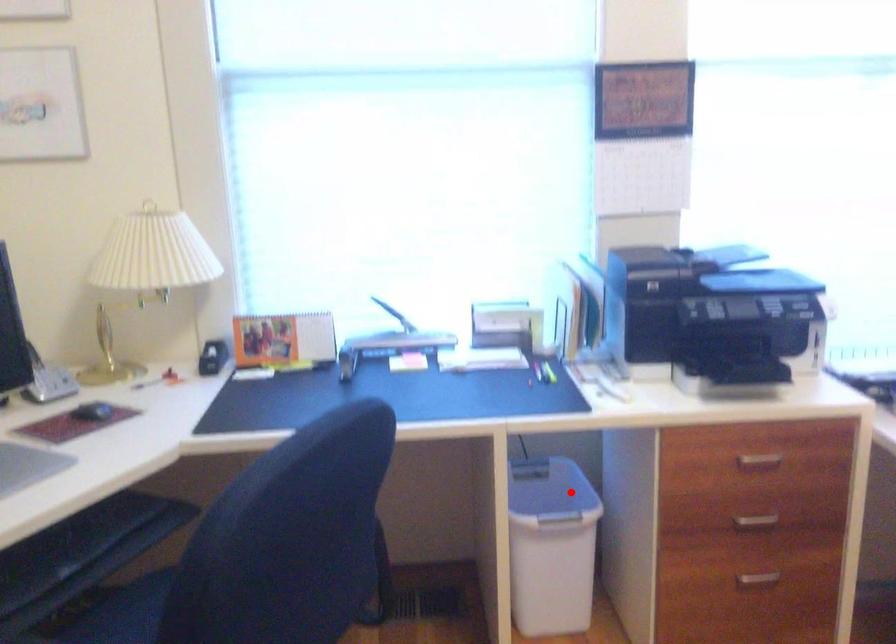
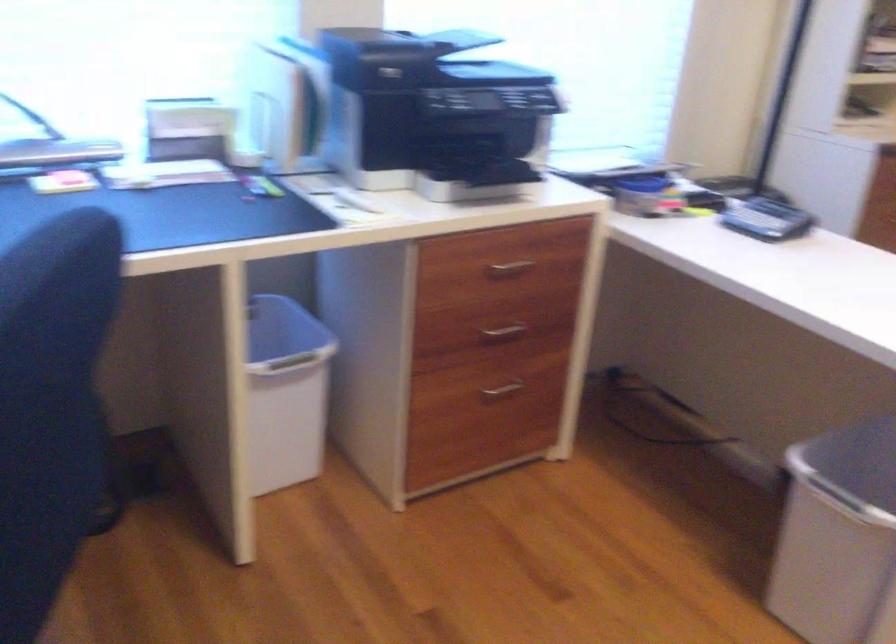
Question: I am providing you with two images of the same scene from different viewpoints. In image1, a red point is highlighted. Considering the same 3D point in image2, which of the following is correct?

Choices:
 (A) It is closer
 (B) It is farther

Answer: (A)